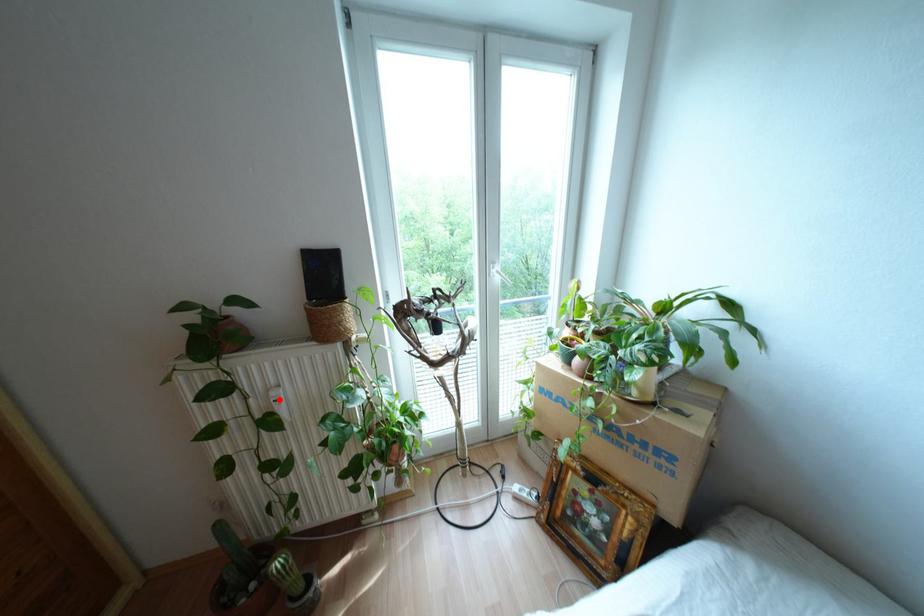
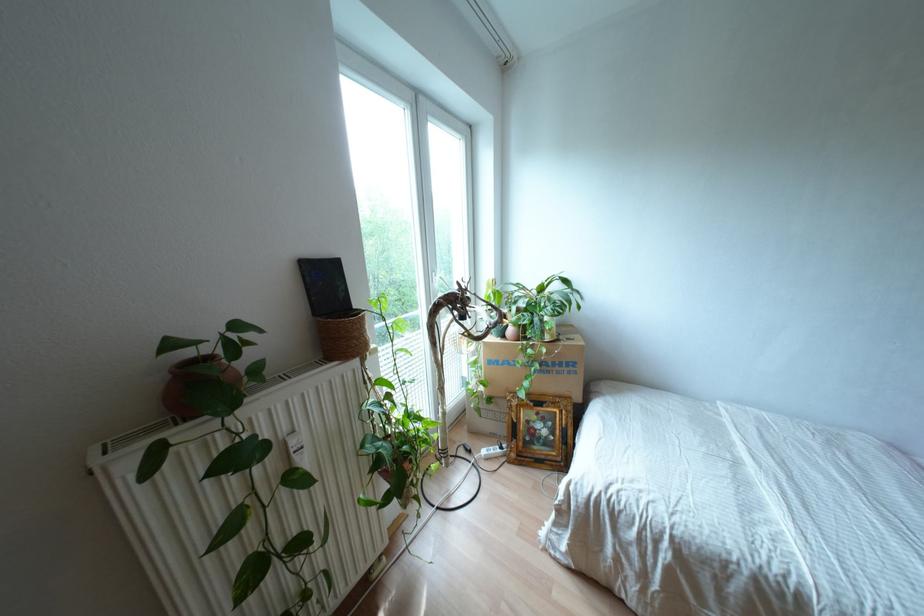
Question: I am providing you with two images of the same scene from different viewpoints. Image1 has a red point marked. In image2, the corresponding 3D location appears at what relative position? Reply with the corresponding letter.

Choices:
 (A) Closer
 (B) Farther

Answer: (A)